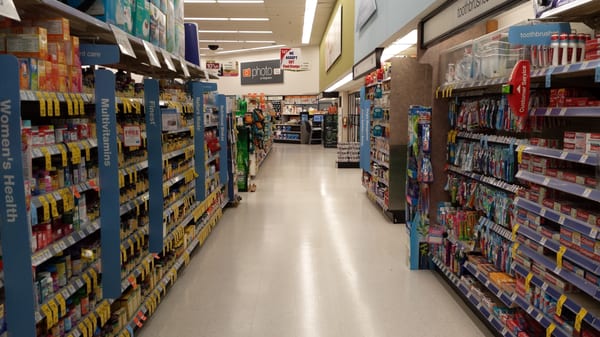
This screenshot has width=600, height=337. In order to click on reflection of lights on the floor in this screenshot , I will do `click(347, 285)`, `click(307, 257)`, `click(328, 204)`.